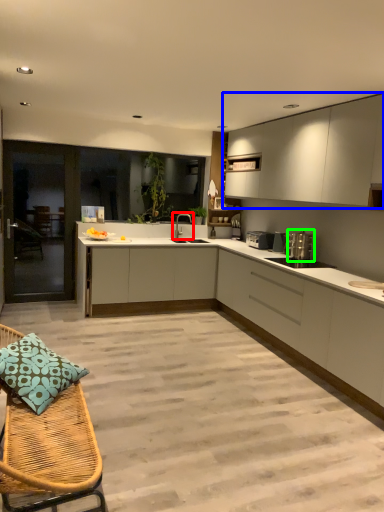
Question: Considering the real-world distances, which object is closest to tap (highlighted by a red box)? cabinetry (highlighted by a blue box) or appliance (highlighted by a green box).

Choices:
 (A) cabinetry
 (B) appliance

Answer: (B)